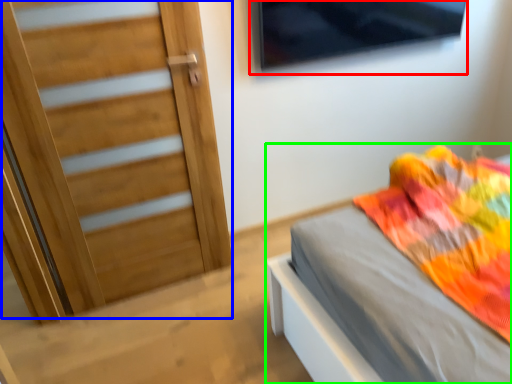
Question: Which object is positioned closest to window (highlighted by a red box)? Select from door (highlighted by a blue box) and bed (highlighted by a green box).

Choices:
 (A) door
 (B) bed

Answer: (A)